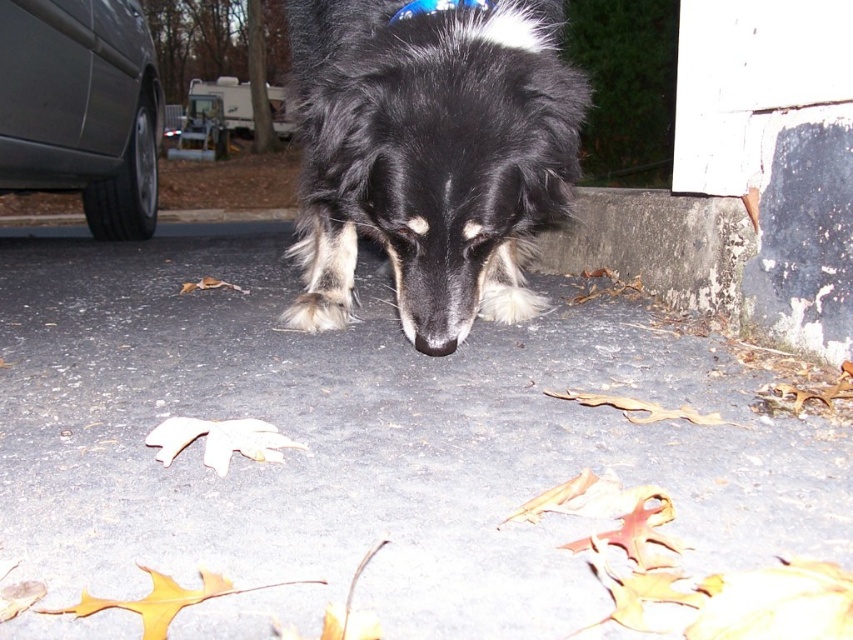
Based on the scene, which object is larger in size between the gray asphalt pavement at center and the blue fabric neckband at upper center?

The gray asphalt pavement at center is bigger than the blue fabric neckband at upper center according to the description.

You are a photographer trying to capture a closeup of the dog. You notice the gray asphalt pavement at center and the blue fabric neckband at upper center. Which object is positioned closer to your camera lens?

The gray asphalt pavement at center is closer to the viewer than the blue fabric neckband at upper center, so the gray asphalt pavement at center would be closer to the camera lens.